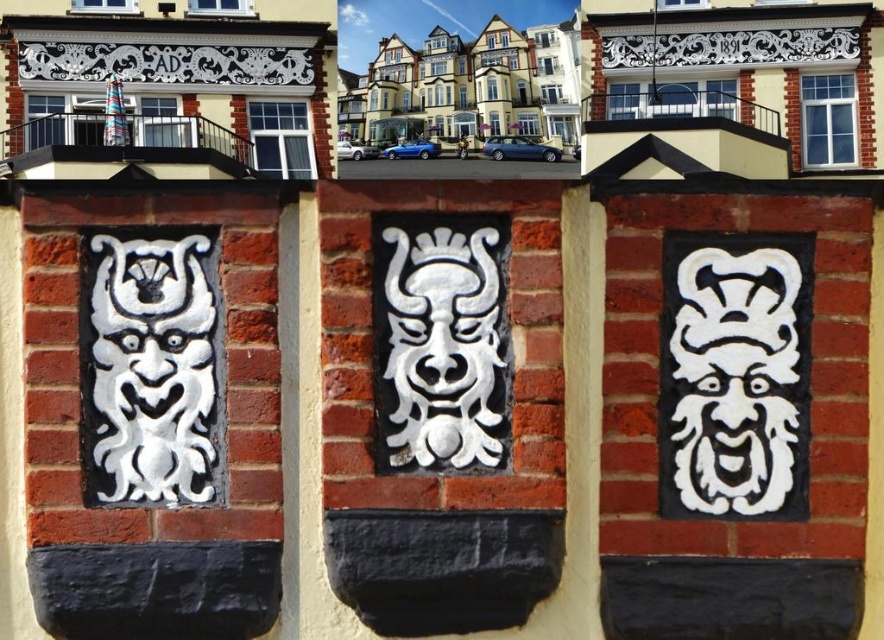
You are an art conservator examining the building facade. You need to clean both the white matte mask at center left and the white matte stone mask at center. Which mask should you start with to minimize ladder climbing?

The white matte mask at center left is closer to the viewer than the white matte stone mask at center, so you should start with the white matte mask at center left to minimize ladder climbing.

From the picture: You are an art restorer working on the building facade. You need to place a new decorative panel between the white matte mask at center left and the white matte stone mask at center. Where should you place it to maintain symmetry?

To maintain symmetry, the new decorative panel should be placed between the white matte mask at center left and the white matte stone mask at center, aligning it centrally between them since the white matte mask at center left is positioned on the left side of the white matte stone mask at center.